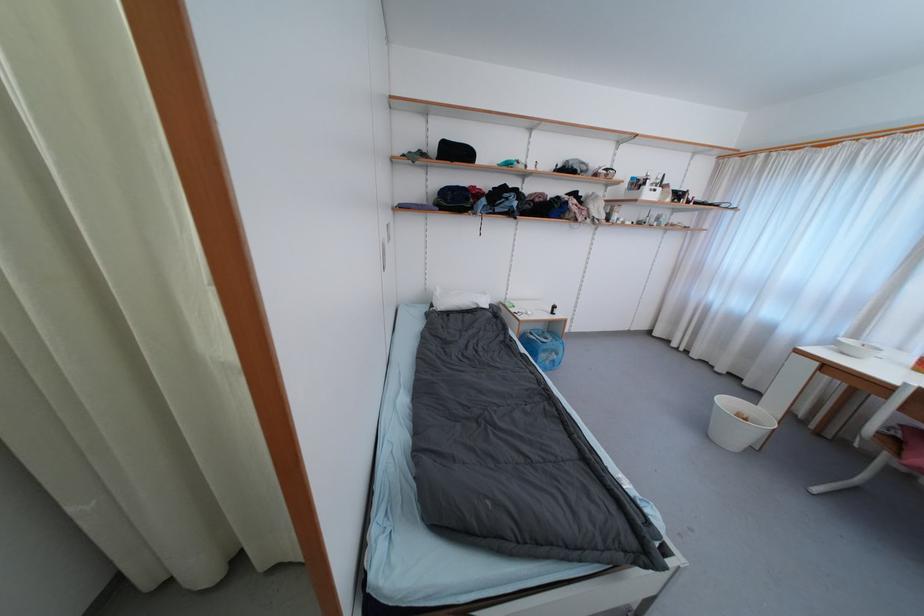
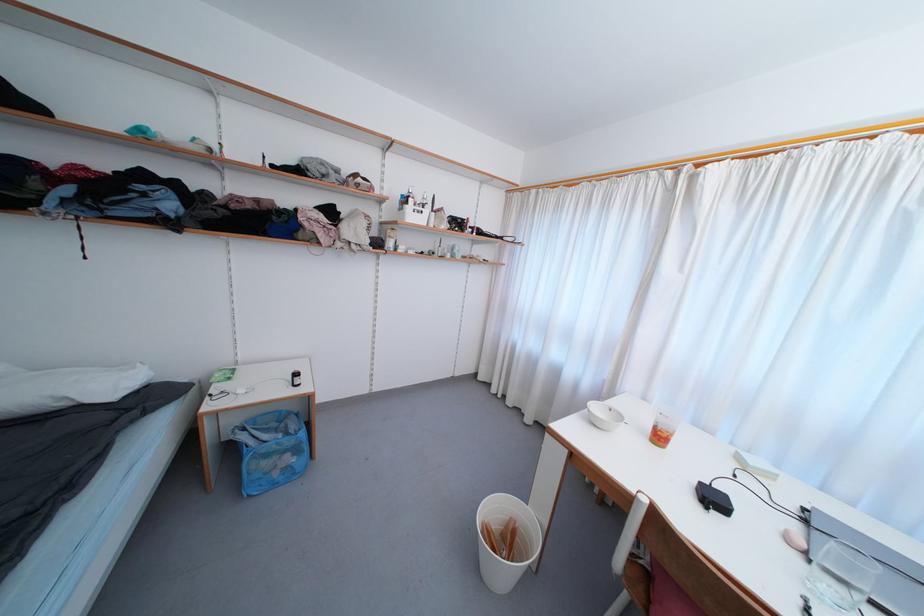
The images are taken continuously from a first-person perspective. In which direction are you moving?

The cameraman moved toward right, forward.